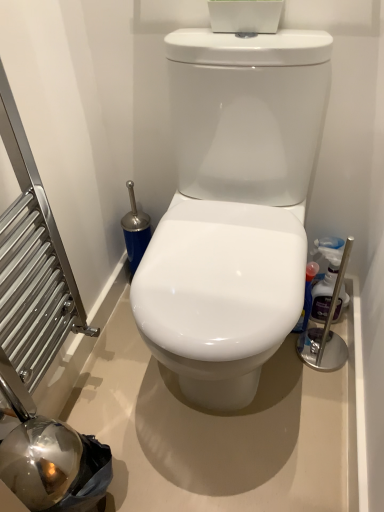
At what (x,y) coordinates should I click in order to perform the action: click on glossy plastic spray bottle at right, the first cleaning product positioned from the left. Please return your answer as a coordinate pair (x, y). The height and width of the screenshot is (512, 384). Looking at the image, I should click on (307, 297).

The width and height of the screenshot is (384, 512). Describe the element at coordinates (326, 276) in the screenshot. I see `translucent plastic bottle at right, the 1th cleaning product viewed from the right` at that location.

Where is `white glossy toilet at center`? white glossy toilet at center is located at coordinates (233, 208).

How many degrees apart are the facing directions of white glossy toilet at center and glossy plastic spray bottle at right, the first cleaning product positioned from the left?

The angular difference between white glossy toilet at center and glossy plastic spray bottle at right, the first cleaning product positioned from the left, is 2.32 degrees.

From the image's perspective, is white glossy toilet at center on glossy plastic spray bottle at right, the first cleaning product positioned from the left?

Yes, from the image's perspective, white glossy toilet at center is over glossy plastic spray bottle at right, the first cleaning product positioned from the left.

Locate an element on the screen. toilet above the glossy plastic spray bottle at right, the first cleaning product positioned from the left (from the image's perspective) is located at coordinates (233, 208).

Is the depth of translucent plastic bottle at right, the 1th cleaning product viewed from the right, less than that of glossy plastic spray bottle at right, the first cleaning product positioned from the left?

Yes, translucent plastic bottle at right, the 1th cleaning product viewed from the right, is in front of glossy plastic spray bottle at right, the first cleaning product positioned from the left.

Is translucent plastic bottle at right, the 2th cleaning product when ordered from left to right, aimed at glossy plastic spray bottle at right, which appears as the second cleaning product when viewed from the right?

No.

Is translucent plastic bottle at right, the 2th cleaning product when ordered from left to right, smaller than glossy plastic spray bottle at right, the first cleaning product positioned from the left?

Indeed, translucent plastic bottle at right, the 2th cleaning product when ordered from left to right, has a smaller size compared to glossy plastic spray bottle at right, the first cleaning product positioned from the left.

Would you say translucent plastic bottle at right, the 2th cleaning product when ordered from left to right, is outside glossy plastic spray bottle at right, which appears as the second cleaning product when viewed from the right?

Yes, translucent plastic bottle at right, the 2th cleaning product when ordered from left to right, is outside of glossy plastic spray bottle at right, which appears as the second cleaning product when viewed from the right.

Is translucent plastic bottle at right, the 1th cleaning product viewed from the right, smaller than white glossy toilet at center?

Indeed, translucent plastic bottle at right, the 1th cleaning product viewed from the right, has a smaller size compared to white glossy toilet at center.

Which object is closer to the camera taking this photo, translucent plastic bottle at right, the 1th cleaning product viewed from the right, or white glossy toilet at center?

white glossy toilet at center.

Is translucent plastic bottle at right, the 1th cleaning product viewed from the right, placed right next to white glossy toilet at center?

No, translucent plastic bottle at right, the 1th cleaning product viewed from the right, is not making contact with white glossy toilet at center.

Is white glossy toilet at center aimed at translucent plastic bottle at right, the 2th cleaning product when ordered from left to right?

No, white glossy toilet at center is not facing towards translucent plastic bottle at right, the 2th cleaning product when ordered from left to right.

Between white glossy toilet at center and translucent plastic bottle at right, the 2th cleaning product when ordered from left to right, which one has smaller width?

With smaller width is translucent plastic bottle at right, the 2th cleaning product when ordered from left to right.

Looking at this image, from the image's perspective, would you say white glossy toilet at center is positioned over translucent plastic bottle at right, the 2th cleaning product when ordered from left to right?

Yes.

Between point (253, 338) and point (327, 306), which one is positioned behind?

Positioned behind is point (327, 306).

Is glossy plastic spray bottle at right, which appears as the second cleaning product when viewed from the right, situated inside translucent plastic bottle at right, the 2th cleaning product when ordered from left to right, or outside?

The correct answer is: outside.

Looking at the image, does glossy plastic spray bottle at right, the first cleaning product positioned from the left, seem bigger or smaller compared to translucent plastic bottle at right, the 2th cleaning product when ordered from left to right?

In the image, glossy plastic spray bottle at right, the first cleaning product positioned from the left, appears to be larger than translucent plastic bottle at right, the 2th cleaning product when ordered from left to right.

What's the angular difference between glossy plastic spray bottle at right, which appears as the second cleaning product when viewed from the right, and translucent plastic bottle at right, the 1th cleaning product viewed from the right,'s facing directions?

The facing directions of glossy plastic spray bottle at right, which appears as the second cleaning product when viewed from the right, and translucent plastic bottle at right, the 1th cleaning product viewed from the right, are 1.23 degrees apart.

Looking at this image, is glossy plastic spray bottle at right, which appears as the second cleaning product when viewed from the right, wider than translucent plastic bottle at right, the 2th cleaning product when ordered from left to right?

Yes.

From the image's perspective, is glossy plastic spray bottle at right, the first cleaning product positioned from the left, beneath white glossy toilet at center?

Indeed, from the image's perspective, glossy plastic spray bottle at right, the first cleaning product positioned from the left, is shown beneath white glossy toilet at center.

Between glossy plastic spray bottle at right, the first cleaning product positioned from the left, and white glossy toilet at center, which one appears on the right side from the viewer's perspective?

From the viewer's perspective, glossy plastic spray bottle at right, the first cleaning product positioned from the left, appears more on the right side.

Considering the relative positions of glossy plastic spray bottle at right, which appears as the second cleaning product when viewed from the right, and white glossy toilet at center in the image provided, is glossy plastic spray bottle at right, which appears as the second cleaning product when viewed from the right, behind white glossy toilet at center?

Yes, it is behind white glossy toilet at center.

Is glossy plastic spray bottle at right, the first cleaning product positioned from the left, not inside white glossy toilet at center?

No, glossy plastic spray bottle at right, the first cleaning product positioned from the left, is not outside of white glossy toilet at center.

At what (x,y) coordinates should I click in order to perform the action: click on the 2nd cleaning product behind the white glossy toilet at center. Please return your answer as a coordinate pair (x, y). The height and width of the screenshot is (512, 384). Looking at the image, I should click on (307, 297).

Find the location of a particular element. cleaning product directly beneath the translucent plastic bottle at right, the 2th cleaning product when ordered from left to right (from a real-world perspective) is located at coordinates (307, 297).

Looking at the image, which one is located closer to glossy plastic spray bottle at right, the first cleaning product positioned from the left, translucent plastic bottle at right, the 2th cleaning product when ordered from left to right, or white glossy toilet at center?

translucent plastic bottle at right, the 2th cleaning product when ordered from left to right, is closer to glossy plastic spray bottle at right, the first cleaning product positioned from the left.

Which object lies further to the anchor point white glossy toilet at center, glossy plastic spray bottle at right, which appears as the second cleaning product when viewed from the right, or translucent plastic bottle at right, the 1th cleaning product viewed from the right?

translucent plastic bottle at right, the 1th cleaning product viewed from the right, is further to white glossy toilet at center.

Which object lies further to the anchor point translucent plastic bottle at right, the 1th cleaning product viewed from the right, white glossy toilet at center or glossy plastic spray bottle at right, the first cleaning product positioned from the left?

Based on the image, white glossy toilet at center appears to be further to translucent plastic bottle at right, the 1th cleaning product viewed from the right.

Looking at the image, which one is located further to glossy plastic spray bottle at right, the first cleaning product positioned from the left, white glossy toilet at center or translucent plastic bottle at right, the 1th cleaning product viewed from the right?

white glossy toilet at center is further to glossy plastic spray bottle at right, the first cleaning product positioned from the left.

When comparing their distances from translucent plastic bottle at right, the 1th cleaning product viewed from the right, does glossy plastic spray bottle at right, which appears as the second cleaning product when viewed from the right, or white glossy toilet at center seem further?

Based on the image, white glossy toilet at center appears to be further to translucent plastic bottle at right, the 1th cleaning product viewed from the right.

From the picture: Considering their positions, is translucent plastic bottle at right, the 2th cleaning product when ordered from left to right, positioned closer to white glossy toilet at center than glossy plastic spray bottle at right, the first cleaning product positioned from the left?

Among the two, glossy plastic spray bottle at right, the first cleaning product positioned from the left, is located nearer to white glossy toilet at center.

I want to click on cleaning product between white glossy toilet at center and glossy plastic spray bottle at right, the first cleaning product positioned from the left, from front to back, so click(x=326, y=276).